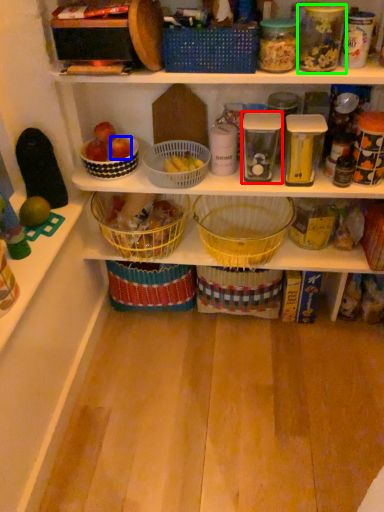
Question: Estimate the real-world distances between objects in this image. Which object is farther from glass jar (highlighted by a red box), apple (highlighted by a blue box) or glass jar (highlighted by a green box)?

Choices:
 (A) apple
 (B) glass jar

Answer: (A)